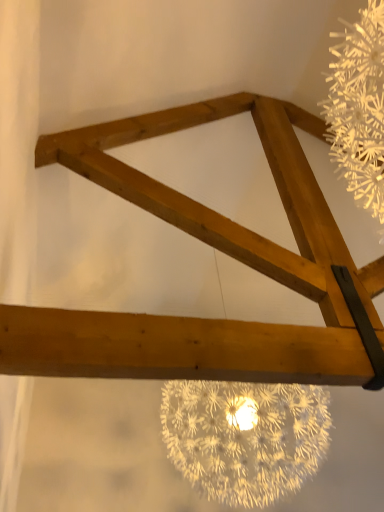
Identify the location of natural wood ladder at upper center. The width and height of the screenshot is (384, 512). pyautogui.click(x=223, y=216).

This screenshot has height=512, width=384. What do you see at coordinates (223, 216) in the screenshot?
I see `natural wood ladder at upper center` at bounding box center [223, 216].

The image size is (384, 512). What are the coordinates of `natural wood ladder at upper center` in the screenshot? It's located at (223, 216).